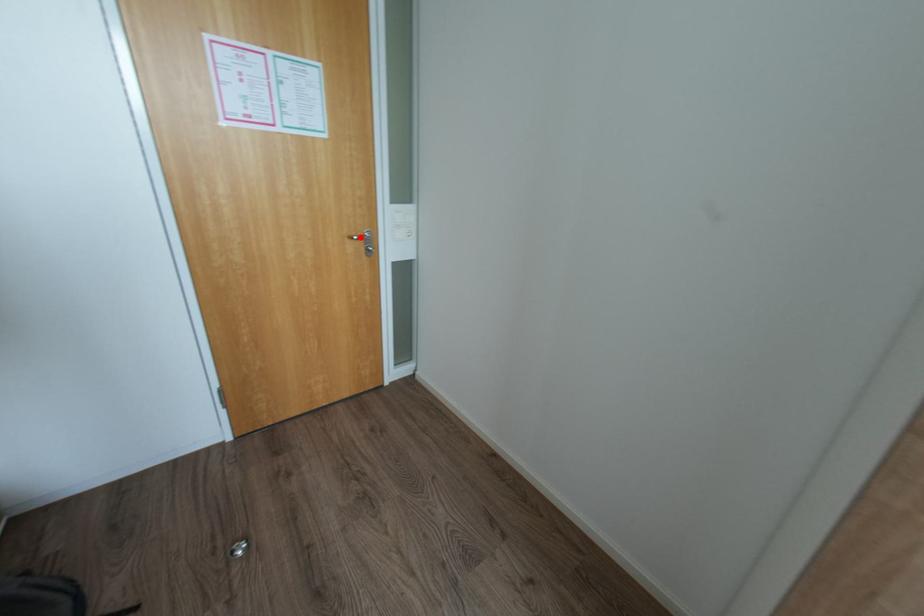
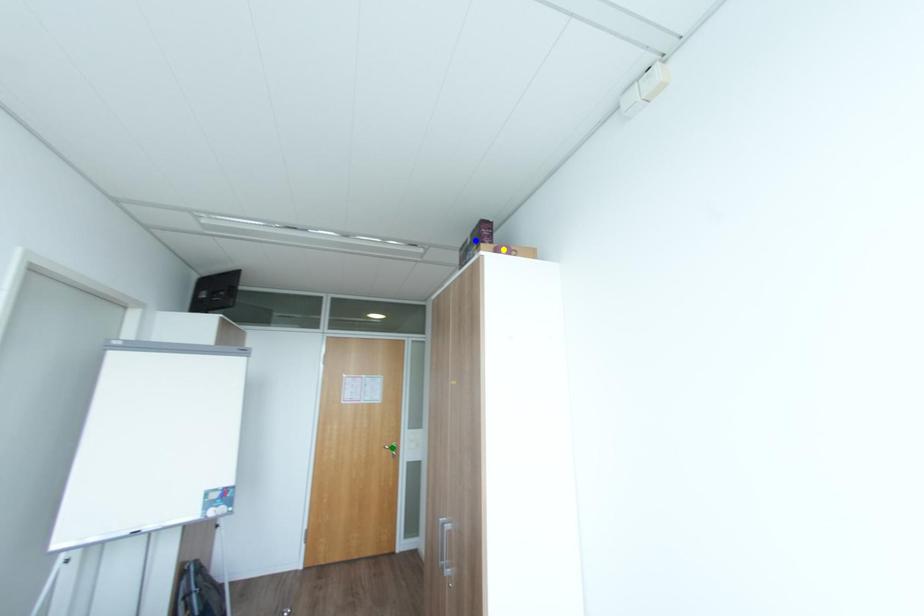
Question: I am providing you with two images of the same scene from different viewpoints. A red point is marked on the first image. You are given multiple points on the second image. In image 2, which mark is for the same physical point as the one in image 1?

Choices:
 (A) blue point
 (B) yellow point
 (C) green point

Answer: (C)